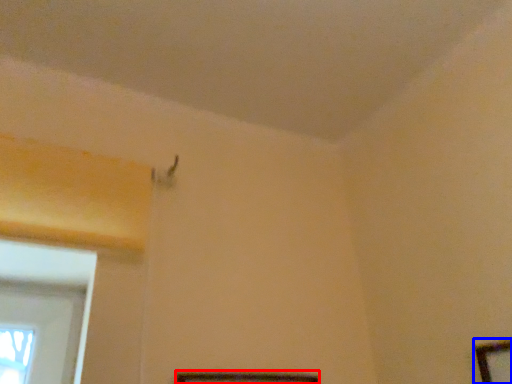
Question: Which object appears farthest to the camera in this image, picture frame (highlighted by a red box) or picture frame (highlighted by a blue box)?

Choices:
 (A) picture frame
 (B) picture frame

Answer: (A)